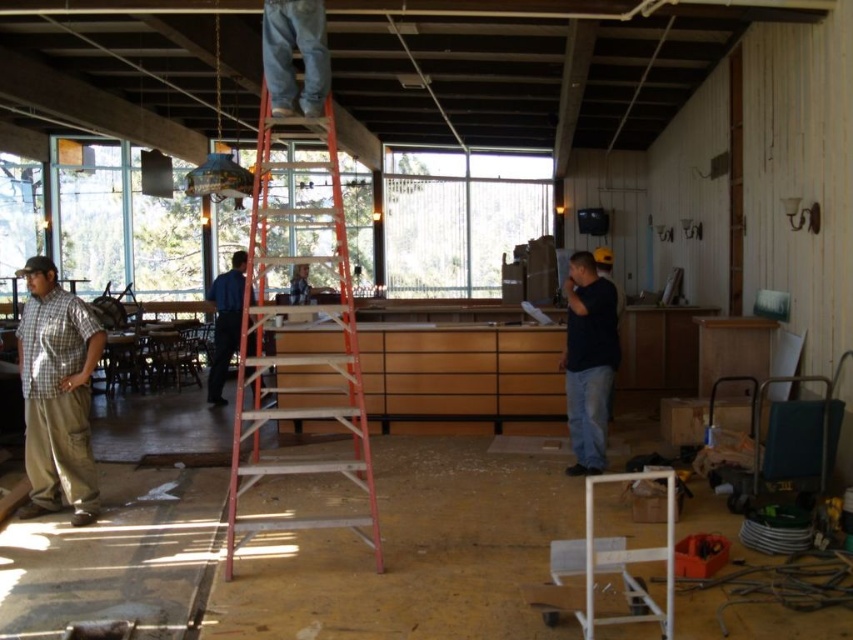
You are standing at the camera position and want to reach point (74, 294). The ladder is 6 meters long. Can you safely climb the ladder to reach that point?

The distance to point (74, 294) is 6.43 meters, which is longer than the ladder length of 6 meters. Therefore, you cannot safely reach that point with the ladder.

You are a contractor observing the construction site. You notice two workers wearing a checkered fabric shirt at left and a blue shirt at center. Which worker is closer to the ladder?

The checkered fabric shirt at left is smaller than the blue shirt at center, which indicates that the checkered fabric shirt at left is farther away from the observer, so the blue shirt at center is closer to the ladder.

You are a contractor assessing the safety of the construction site. You notice two workers in the scene, one wearing a checkered fabric shirt at left and another in a dark blue shirt at center. Based on their heights, which worker might be at a higher risk of injury if they were to fall from the ladder?

The checkered fabric shirt at left is much taller than the dark blue shirt at center, so the worker in the checkered fabric shirt at left might be at a higher risk of injury due to their greater height increasing the potential fall distance.